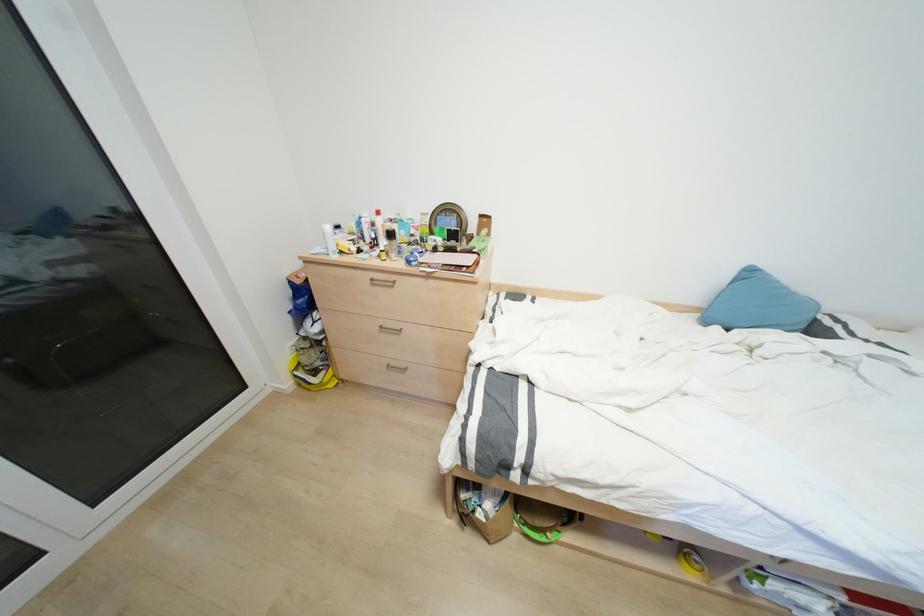
Identify the location of silver drawer handle. (382, 282).